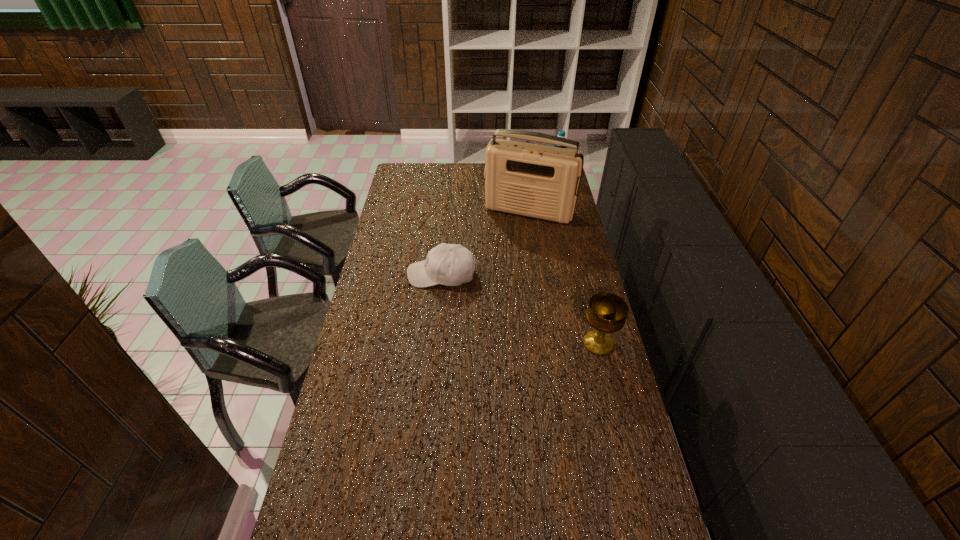
I want to click on the leftmost object, so click(448, 264).

You are a GUI agent. You are given a task and a screenshot of the screen. Output one action in this format:
    pyautogui.click(x=<x>, y=<y>)
    Task: Click on the shortest object
    
    Given the screenshot: What is the action you would take?
    pyautogui.click(x=448, y=264)

This screenshot has height=540, width=960. What are the coordinates of `the nearest object` in the screenshot? It's located at (606, 313).

At what (x,y) coordinates should I click in order to perform the action: click on chalice. Please return your answer as a coordinate pair (x, y). Looking at the image, I should click on 606,313.

This screenshot has width=960, height=540. In order to click on radio receiver in this screenshot , I will do `click(532, 180)`.

Find the location of a particular element. This screenshot has height=540, width=960. the tallest object is located at coordinates (532, 180).

I want to click on the second tallest object, so click(561, 133).

Where is `the farthest object`? the farthest object is located at coordinates (561, 133).

The image size is (960, 540). In order to click on vacant region located on the front-facing side of the leftmost object in this screenshot , I will do `click(384, 274)`.

Locate an element on the screen. vacant space positioned on the front-facing side of the leftmost object is located at coordinates (391, 274).